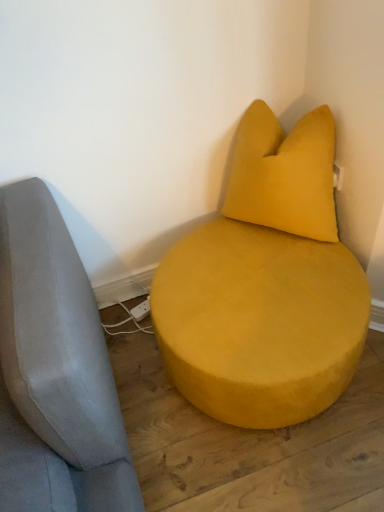
You are a GUI agent. You are given a task and a screenshot of the screen. Output one action in this format:
    pyautogui.click(x=<x>, y=<y>)
    Task: Click on the suede yellow ottoman at center
    This screenshot has width=384, height=512.
    Given the screenshot: What is the action you would take?
    pyautogui.click(x=265, y=285)

This screenshot has height=512, width=384. Describe the element at coordinates (265, 285) in the screenshot. I see `suede yellow ottoman at center` at that location.

Describe the element at coordinates (283, 174) in the screenshot. This screenshot has width=384, height=512. I see `velvet yellow pillow at upper right` at that location.

This screenshot has width=384, height=512. Identify the location of velvet yellow pillow at upper right. (283, 174).

Locate an element on the screen. suede yellow ottoman at center is located at coordinates (265, 285).

Considering the positions of objects suede yellow ottoman at center and velvet yellow pillow at upper right in the image provided, who is more to the right, suede yellow ottoman at center or velvet yellow pillow at upper right?

From the viewer's perspective, velvet yellow pillow at upper right appears more on the right side.

Is the position of suede yellow ottoman at center more distant than that of velvet yellow pillow at upper right?

No, the depth of suede yellow ottoman at center is less than that of velvet yellow pillow at upper right.

In the scene shown: Which point is more forward, (299,340) or (252,186)?

The point (299,340) is more forward.

From the image's perspective, which one is positioned lower, suede yellow ottoman at center or velvet yellow pillow at upper right?

suede yellow ottoman at center appears lower in the image.

From a real-world perspective, does suede yellow ottoman at center sit lower than velvet yellow pillow at upper right?

Yes, from a real-world perspective, suede yellow ottoman at center is beneath velvet yellow pillow at upper right.

Looking at their sizes, would you say suede yellow ottoman at center is wider or thinner than velvet yellow pillow at upper right?

In the image, suede yellow ottoman at center appears to be wider than velvet yellow pillow at upper right.

Is suede yellow ottoman at center shorter than velvet yellow pillow at upper right?

Yes.

Considering the relative sizes of suede yellow ottoman at center and velvet yellow pillow at upper right in the image provided, is suede yellow ottoman at center bigger than velvet yellow pillow at upper right?

Correct, suede yellow ottoman at center is larger in size than velvet yellow pillow at upper right.

Is suede yellow ottoman at center inside or outside of velvet yellow pillow at upper right?

suede yellow ottoman at center is spatially situated outside velvet yellow pillow at upper right.

Is there a large distance between suede yellow ottoman at center and velvet yellow pillow at upper right?

Actually, suede yellow ottoman at center and velvet yellow pillow at upper right are a little close together.

Is suede yellow ottoman at center oriented towards velvet yellow pillow at upper right?

No, suede yellow ottoman at center is not facing towards velvet yellow pillow at upper right.

Can you tell me how much suede yellow ottoman at center and velvet yellow pillow at upper right differ in facing direction?

The angular difference between suede yellow ottoman at center and velvet yellow pillow at upper right is 89.5 degrees.

I want to click on furniture that is on the left side of velvet yellow pillow at upper right, so click(x=265, y=285).

Consider the image. Is velvet yellow pillow at upper right to the left of suede yellow ottoman at center from the viewer's perspective?

Incorrect, velvet yellow pillow at upper right is not on the left side of suede yellow ottoman at center.

From the picture: Which object is further away from the camera, velvet yellow pillow at upper right or suede yellow ottoman at center?

velvet yellow pillow at upper right.

Which is farther from the camera, (260, 224) or (288, 376)?

The point (260, 224) is farther from the camera.

From the image's perspective, who appears lower, velvet yellow pillow at upper right or suede yellow ottoman at center?

suede yellow ottoman at center is shown below in the image.

From a real-world perspective, is velvet yellow pillow at upper right positioned above or below suede yellow ottoman at center?

In terms of real-world spatial position, velvet yellow pillow at upper right is above suede yellow ottoman at center.

Looking at this image, considering the sizes of objects velvet yellow pillow at upper right and suede yellow ottoman at center in the image provided, who is thinner, velvet yellow pillow at upper right or suede yellow ottoman at center?

Thinner between the two is velvet yellow pillow at upper right.

In terms of height, does velvet yellow pillow at upper right look taller or shorter compared to suede yellow ottoman at center?

velvet yellow pillow at upper right is taller than suede yellow ottoman at center.

Does velvet yellow pillow at upper right have a smaller size compared to suede yellow ottoman at center?

Yes.

Do you think velvet yellow pillow at upper right is within suede yellow ottoman at center, or outside of it?

velvet yellow pillow at upper right exists outside the volume of suede yellow ottoman at center.

Is velvet yellow pillow at upper right not close to suede yellow ottoman at center?

No, there isn't a large distance between velvet yellow pillow at upper right and suede yellow ottoman at center.

Could you tell me if velvet yellow pillow at upper right is facing suede yellow ottoman at center?

No.

Where is `furniture below the velvet yellow pillow at upper right (from a real-world perspective)`? The height and width of the screenshot is (512, 384). furniture below the velvet yellow pillow at upper right (from a real-world perspective) is located at coordinates (265, 285).

I want to click on furniture on the left side of velvet yellow pillow at upper right, so click(265, 285).

Find the location of `pillow behind the suede yellow ottoman at center`. pillow behind the suede yellow ottoman at center is located at coordinates (283, 174).